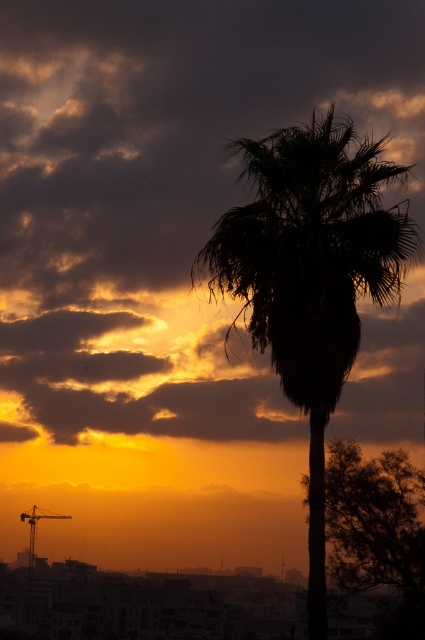
You are an artist trying to paint the sunset scene. You want to ensure the silhouette leafy palm at center and the silky brown tree at center are positioned correctly. Which object should you paint first to create the proper layering?

You should paint the silky brown tree at center first because the silhouette leafy palm at center is in front of it, so the palm needs to be layered on top to achieve the correct depth.

You are standing in front of the sunset scene and want to know which of the two points, point [107,125] or point [343,483], is closer to you. Can you determine this based on their positions?

Point [107,125] is further to the camera than point [343,483], so the closer point to you is point [343,483].